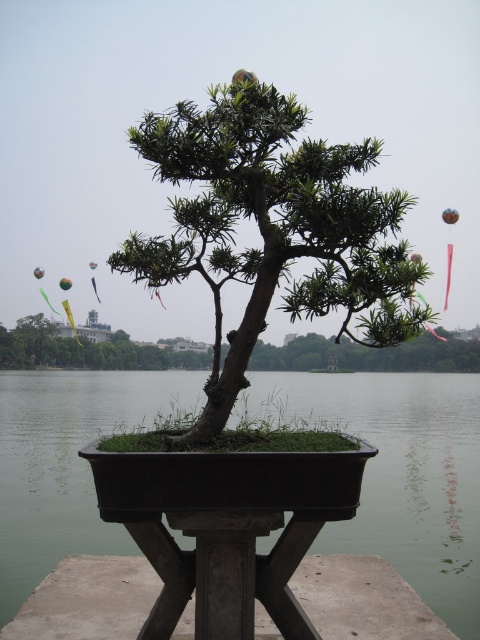
Can you confirm if green concrete water at center is taller than green matte bonsai tree at center?

Correct, green concrete water at center is much taller as green matte bonsai tree at center.

The image size is (480, 640). I want to click on green concrete water at center, so click(x=406, y=476).

Is point (304, 372) farther from viewer compared to point (168, 362)?

Yes.

Find the location of a particular element. green concrete water at center is located at coordinates (406, 476).

Who is higher up, green matte bonsai at center or green matte bonsai tree at center?

green matte bonsai at center

Is the position of green matte bonsai at center less distant than that of green matte bonsai tree at center?

That is True.

Is point (382, 248) in front of point (40, 342)?

Yes, point (382, 248) is in front of point (40, 342).

The width and height of the screenshot is (480, 640). Find the location of `green matte bonsai at center`. green matte bonsai at center is located at coordinates (272, 228).

Who is more distant from viewer, (x=359, y=512) or (x=387, y=332)?

The point (x=359, y=512) is more distant.

Where is `green concrete water at center`? The height and width of the screenshot is (640, 480). green concrete water at center is located at coordinates (406, 476).

Where is `green concrete water at center`? The image size is (480, 640). green concrete water at center is located at coordinates (406, 476).